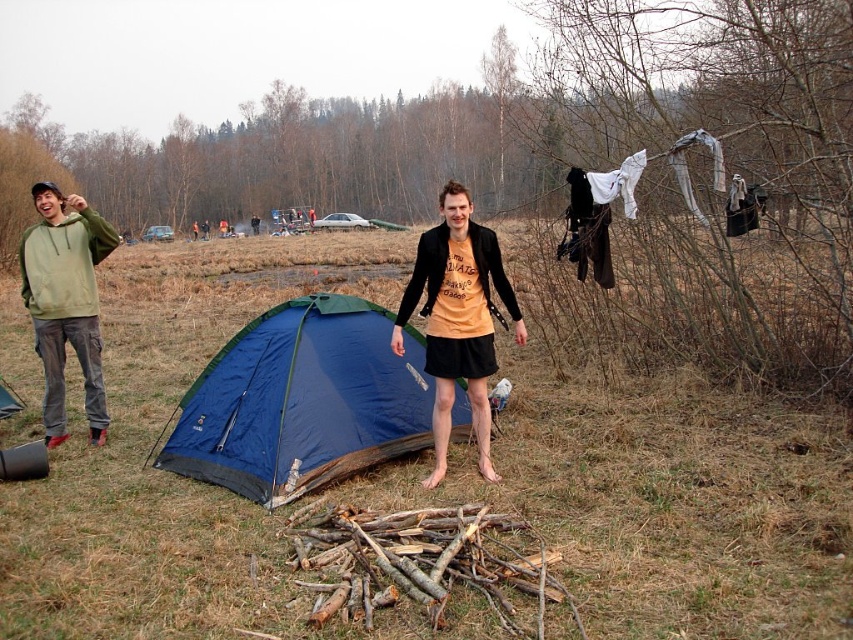
Question: Which point is farther to the camera?

Choices:
 (A) (451, 412)
 (B) (247, 324)
 (C) (96, 243)
 (D) (466, 262)

Answer: (C)

Question: Can you confirm if blue fabric tent at center is positioned to the left of green fleece hoodie at left?

Choices:
 (A) no
 (B) yes

Answer: (A)

Question: Can you confirm if matte green hoodie at left is positioned to the right of orange matte t-shirt at center?

Choices:
 (A) no
 (B) yes

Answer: (A)

Question: Can you confirm if blue fabric tent at center is positioned above green fleece hoodie at left?

Choices:
 (A) yes
 (B) no

Answer: (B)

Question: Which of these objects is positioned farthest from the matte green hoodie at left?

Choices:
 (A) blue fabric tent at center
 (B) green fleece hoodie at left
 (C) orange matte t-shirt at center

Answer: (B)

Question: Which object appears closest to the camera in this image?

Choices:
 (A) orange matte t-shirt at center
 (B) blue fabric tent at center
 (C) green fleece hoodie at left

Answer: (B)